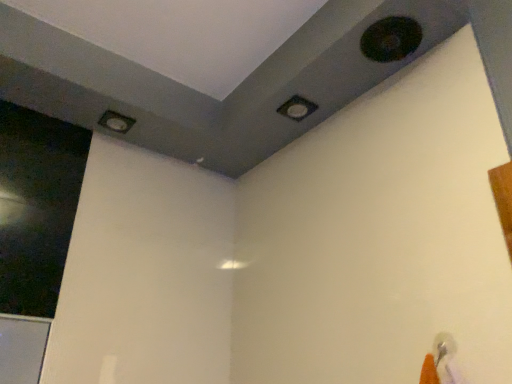
Question: Is matte black square at upper center, which is the 2th hole from top to bottom, next to transparent glass screen door at left and touching it?

Choices:
 (A) no
 (B) yes

Answer: (A)

Question: Is matte black square at upper center, which is the 2th hole from top to bottom, at the right side of transparent glass screen door at left?

Choices:
 (A) no
 (B) yes

Answer: (B)

Question: Is matte black square at upper center, positioned as the second hole in back-to-front order, further to camera compared to transparent glass screen door at left?

Choices:
 (A) yes
 (B) no

Answer: (A)

Question: Is matte black square at upper center, which is the 2th hole in front-to-back order, not inside transparent glass screen door at left?

Choices:
 (A) yes
 (B) no

Answer: (A)

Question: From a real-world perspective, is matte black square at upper center, which is the 2th hole from top to bottom, on top of transparent glass screen door at left?

Choices:
 (A) yes
 (B) no

Answer: (A)

Question: From a real-world perspective, is transparent glass screen door at left physically located above or below matte gray hole at upper left, the third hole in the top-to-bottom sequence?

Choices:
 (A) below
 (B) above

Answer: (A)

Question: Considering the positions of point (61, 190) and point (130, 119), is point (61, 190) closer or farther from the camera than point (130, 119)?

Choices:
 (A) closer
 (B) farther

Answer: (A)

Question: Considering their positions, is transparent glass screen door at left located in front of or behind matte gray hole at upper left, placed as the first hole when sorted from left to right?

Choices:
 (A) front
 (B) behind

Answer: (A)

Question: From the image's perspective, relative to matte gray hole at upper left, which appears as the first hole when viewed from the back, is transparent glass screen door at left above or below?

Choices:
 (A) below
 (B) above

Answer: (A)

Question: In terms of size, does transparent glass screen door at left appear bigger or smaller than black matte hole at upper right, which is counted as the 1th hole, starting from the front?

Choices:
 (A) big
 (B) small

Answer: (A)

Question: In the image, is transparent glass screen door at left on the left side or the right side of black matte hole at upper right, which is the first hole in top-to-bottom order?

Choices:
 (A) right
 (B) left

Answer: (B)

Question: From their relative heights in the image, would you say transparent glass screen door at left is taller or shorter than black matte hole at upper right, which is counted as the third hole, starting from the bottom?

Choices:
 (A) tall
 (B) short

Answer: (A)

Question: From a real-world perspective, is transparent glass screen door at left physically located above or below black matte hole at upper right, the 3th hole when ordered from left to right?

Choices:
 (A) above
 (B) below

Answer: (B)

Question: Is matte black square at upper center, the second hole in the right-to-left sequence, taller or shorter than black matte hole at upper right, marked as the first hole in a right-to-left arrangement?

Choices:
 (A) short
 (B) tall

Answer: (A)

Question: Considering the positions of matte black square at upper center, which is the 2th hole from top to bottom, and black matte hole at upper right, which is the first hole in top-to-bottom order, in the image, is matte black square at upper center, which is the 2th hole from top to bottom, wider or thinner than black matte hole at upper right, which is the first hole in top-to-bottom order,?

Choices:
 (A) wide
 (B) thin

Answer: (B)